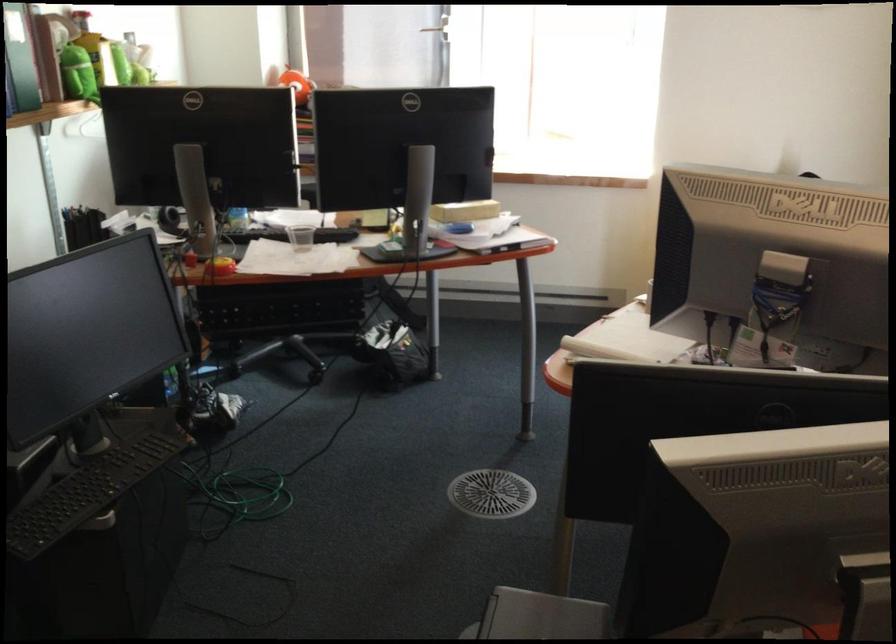
The image size is (896, 644). Describe the element at coordinates (433, 29) in the screenshot. I see `the door handle` at that location.